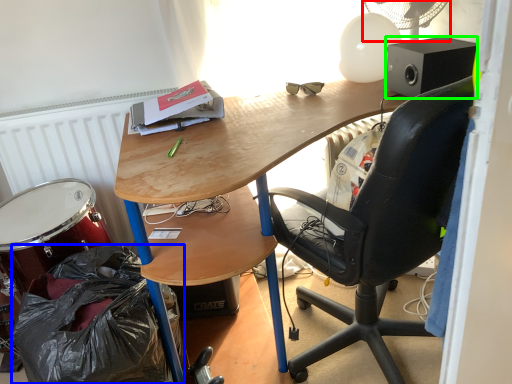
Question: Based on their relative distances, which object is nearer to mechanical fan (highlighted by a red box)? Choose from garbage (highlighted by a blue box) and loudspeaker (highlighted by a green box).

Choices:
 (A) garbage
 (B) loudspeaker

Answer: (B)